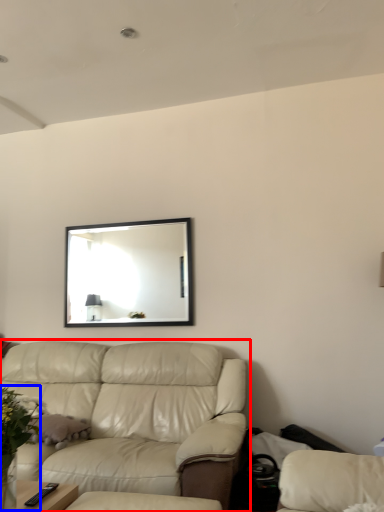
Question: Among these objects, which one is farthest to the camera, studio couch (highlighted by a red box) or floral arrangement (highlighted by a blue box)?

Choices:
 (A) studio couch
 (B) floral arrangement

Answer: (A)